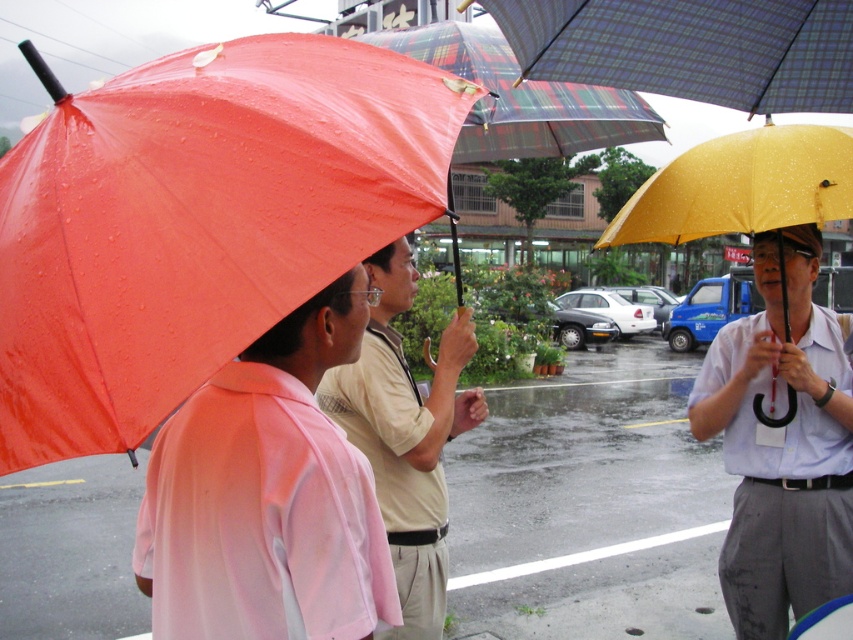
You are a pedestrian trying to cross the street while holding the shiny orange umbrella at left and the matte yellow umbrella at center. Since you can only carry one umbrella at a time, which one should you choose to stay dry if you want to walk under the one that provides more coverage over your body?

The shiny orange umbrella at left is located above the matte yellow umbrella at center, meaning it is taller and offers better coverage. Choose the shiny orange umbrella at left to stay dry.

You are standing at the origin point in the image. The point at coordinates (x=198, y=221) is marked. Which object does this point correspond to?

The point at coordinates (x=198, y=221) corresponds to the shiny orange umbrella at left.

From the picture: You are a photographer standing at the point labeled as point (x=358, y=248). You want to take a photo of the three people under their umbrellas. If your camera has a focal length of 50mm and you need to be at least 1 meter away to avoid blurring the subjects, will you be able to take the photo without moving?

The distance between point (x=358, y=248) and the camera is 1.01 meters, which is just over the required 1 meter. Therefore, you can take the photo without moving as the distance meets the minimum requirement to avoid blurring.